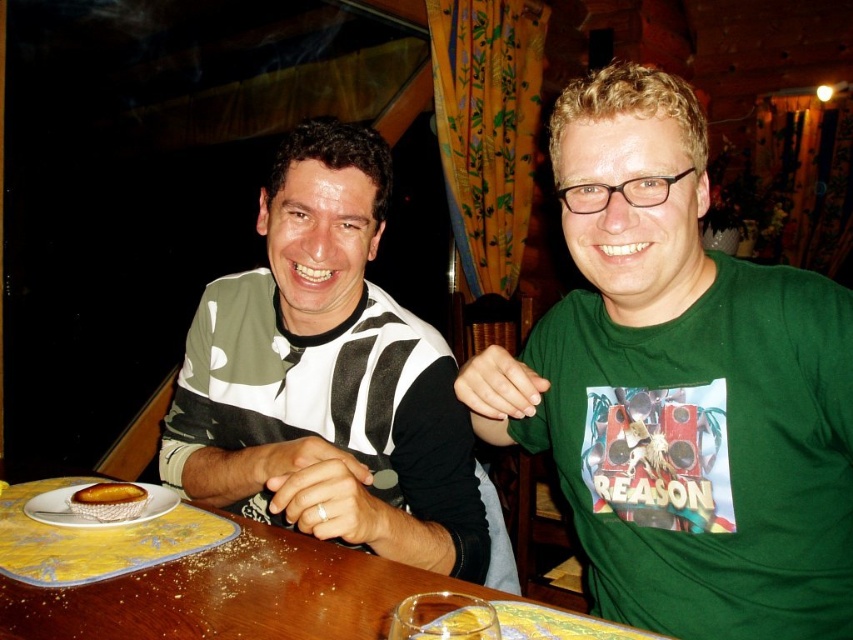
Can you confirm if wooden table at center is bigger than white ceramic plate at lower left?

Yes, wooden table at center is bigger than white ceramic plate at lower left.

The image size is (853, 640). I want to click on wooden table at center, so click(x=216, y=586).

Identify the location of wooden table at center. (216, 586).

Between green cotton t-shirt at center and striped jersey at center, which one is positioned lower?

green cotton t-shirt at center is lower down.

Does point (744, 586) lie behind point (354, 186)?

No, (744, 586) is closer to viewer.

Is point (827, 518) farther from viewer compared to point (386, 554)?

No, it is not.

Where is `green cotton t-shirt at center`? This screenshot has width=853, height=640. green cotton t-shirt at center is located at coordinates (682, 388).

Is the position of striped jersey at center more distant than that of wooden table at center?

Yes, it is.

Does striped jersey at center have a smaller size compared to wooden table at center?

No, striped jersey at center is not smaller than wooden table at center.

Describe the element at coordinates (326, 378) in the screenshot. I see `striped jersey at center` at that location.

Where is `striped jersey at center`? The width and height of the screenshot is (853, 640). striped jersey at center is located at coordinates (326, 378).